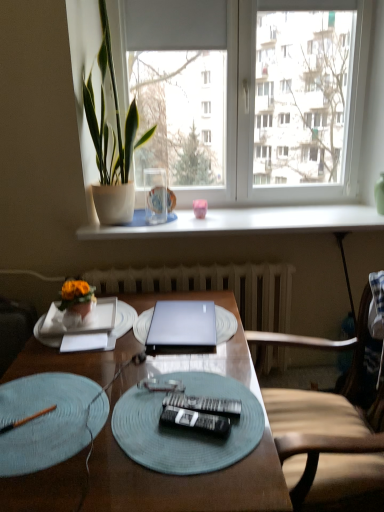
Where is `vacant region to the left of white paper at center`? vacant region to the left of white paper at center is located at coordinates (40, 352).